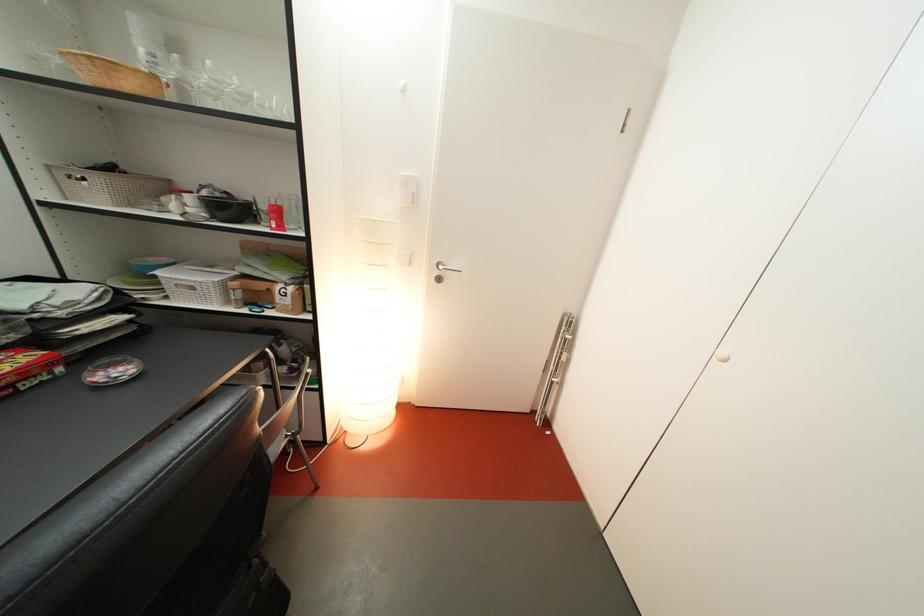
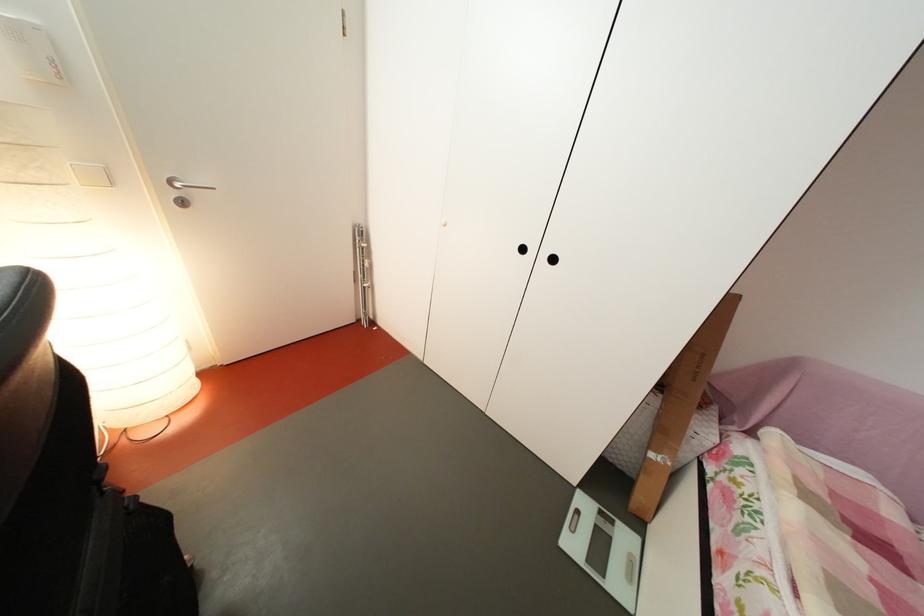
First-person continuous shooting, in which direction is the camera rotating?

The rotation direction of the camera is right-down.